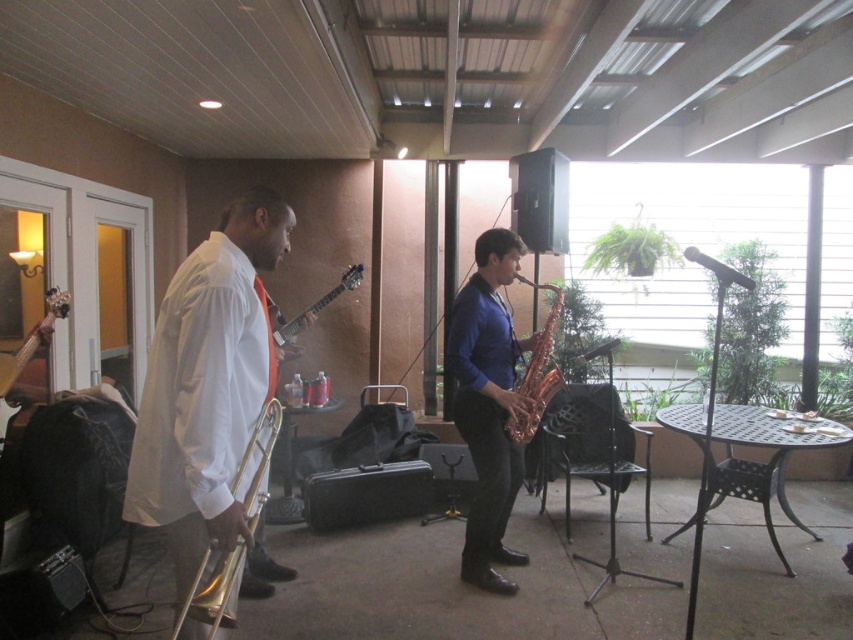
Question: Which object is positioned closest to the shiny gold saxophone at center?

Choices:
 (A) gold brass trombone at left
 (B) glossy wood guitar at center
 (C) gold shiny saxophone at center
 (D) shiny gold trombone at left

Answer: (C)

Question: In this image, where is shiny gold saxophone at center located relative to gold shiny saxophone at center?

Choices:
 (A) below
 (B) above

Answer: (A)

Question: Which of the following is the closest to the observer?

Choices:
 (A) wooden acoustic guitar at left
 (B) gold shiny saxophone at center

Answer: (A)

Question: Considering the relative positions of shiny gold saxophone at center and gold brass trombone at left in the image provided, where is shiny gold saxophone at center located with respect to gold brass trombone at left?

Choices:
 (A) left
 (B) right

Answer: (B)

Question: Which point is closer to the camera taking this photo?

Choices:
 (A) (254, 506)
 (B) (260, 296)
 (C) (223, 403)
 (D) (51, 317)

Answer: (C)

Question: Is shiny gold trombone at left above gold brass trombone at left?

Choices:
 (A) yes
 (B) no

Answer: (A)